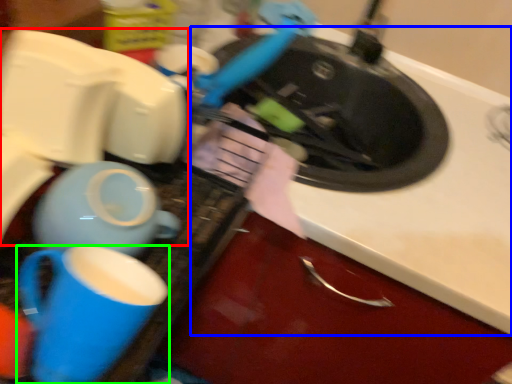
Question: Based on their relative distances, which object is farther from appliance (highlighted by a red box)? Choose from counter top (highlighted by a blue box) and coffee cup (highlighted by a green box).

Choices:
 (A) counter top
 (B) coffee cup

Answer: (A)